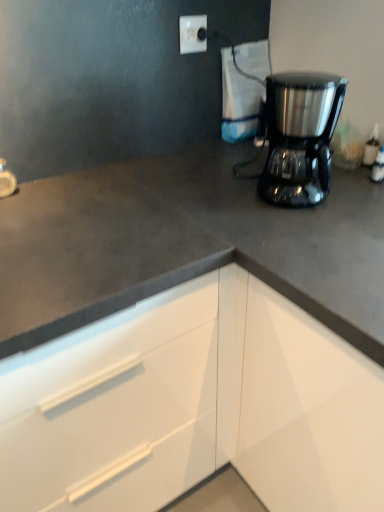
Question: Does white glossy faucet at upper left have a larger size compared to white glossy cabinet at lower right?

Choices:
 (A) no
 (B) yes

Answer: (A)

Question: Is white glossy faucet at upper left shorter than white glossy cabinet at lower right?

Choices:
 (A) no
 (B) yes

Answer: (B)

Question: Considering the relative positions of white glossy faucet at upper left and white glossy cabinet at lower right in the image provided, is white glossy faucet at upper left to the left of white glossy cabinet at lower right from the viewer's perspective?

Choices:
 (A) no
 (B) yes

Answer: (B)

Question: Does white glossy faucet at upper left lie behind white glossy cabinet at lower right?

Choices:
 (A) no
 (B) yes

Answer: (B)

Question: Does white glossy faucet at upper left have a greater width compared to white glossy cabinet at lower right?

Choices:
 (A) no
 (B) yes

Answer: (A)

Question: Does white glossy faucet at upper left have a greater height compared to white glossy cabinet at lower right?

Choices:
 (A) yes
 (B) no

Answer: (B)

Question: Is white glossy cabinet at lower right far away from white plastic electric outlet at upper center?

Choices:
 (A) no
 (B) yes

Answer: (A)

Question: Is white glossy cabinet at lower right smaller than white plastic electric outlet at upper center?

Choices:
 (A) no
 (B) yes

Answer: (A)

Question: Is white glossy cabinet at lower right to the left of white plastic electric outlet at upper center from the viewer's perspective?

Choices:
 (A) yes
 (B) no

Answer: (A)

Question: From the image's perspective, is white glossy cabinet at lower right beneath white plastic electric outlet at upper center?

Choices:
 (A) yes
 (B) no

Answer: (A)

Question: Is white glossy cabinet at lower right surrounding white plastic electric outlet at upper center?

Choices:
 (A) no
 (B) yes

Answer: (A)

Question: Is white glossy cabinet at lower right located outside white plastic electric outlet at upper center?

Choices:
 (A) yes
 (B) no

Answer: (A)

Question: Does white glossy cabinet at lower right turn towards satin black coffee maker at upper right?

Choices:
 (A) yes
 (B) no

Answer: (B)